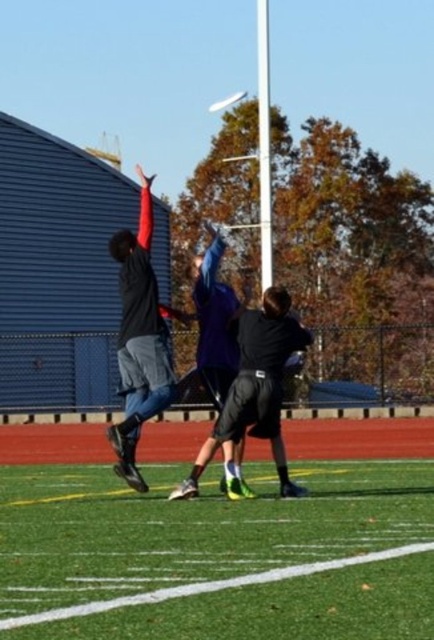
Which of these two, green artificial turf at center or black matte shorts at center, stands shorter?

green artificial turf at center is shorter.

Does green artificial turf at center have a smaller size compared to black matte shorts at center?

Yes.

Image resolution: width=434 pixels, height=640 pixels. What do you see at coordinates (219, 556) in the screenshot? I see `green artificial turf at center` at bounding box center [219, 556].

The image size is (434, 640). Identify the location of green artificial turf at center. (219, 556).